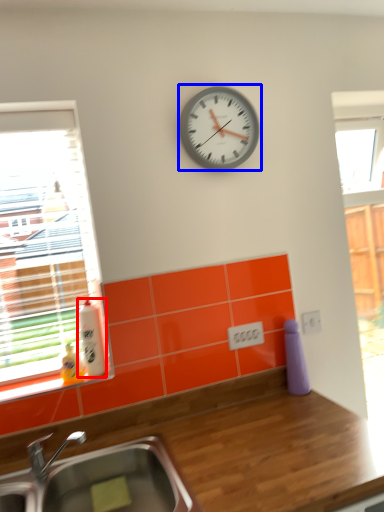
Question: Which object appears closest to the camera in this image, bottle (highlighted by a red box) or wall clock (highlighted by a blue box)?

Choices:
 (A) bottle
 (B) wall clock

Answer: (A)